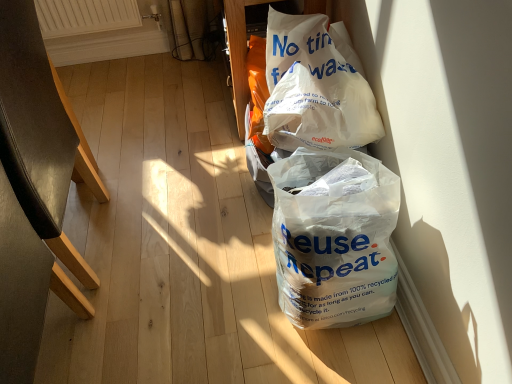
The height and width of the screenshot is (384, 512). Find the location of `vacant area situated to the left side of white plastic bag at lower right, the second plastic bag in the top-to-bottom sequence`. vacant area situated to the left side of white plastic bag at lower right, the second plastic bag in the top-to-bottom sequence is located at coordinates (230, 301).